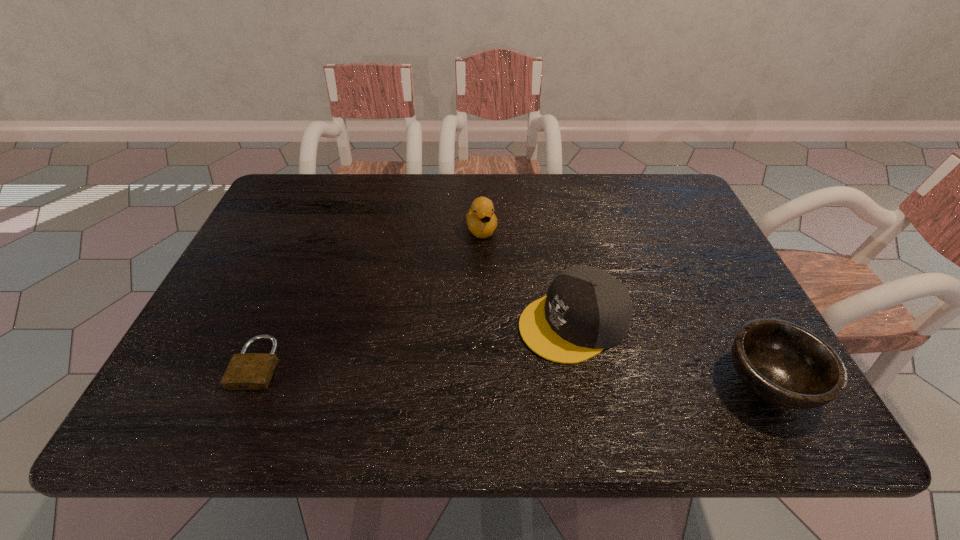
The image size is (960, 540). Identify the location of object at the near left corner. (246, 371).

Find the location of a particular element. The width and height of the screenshot is (960, 540). object positioned at the near right corner is located at coordinates (785, 364).

In the image, there is a desktop. Identify the location of vacant space at the far edge. (530, 205).

In the image, there is a desktop. What are the coordinates of `free space at the near edge` in the screenshot? It's located at (564, 378).

In the image, there is a desktop. Where is `vacant space at the left edge`? The height and width of the screenshot is (540, 960). vacant space at the left edge is located at coordinates (276, 272).

In the image, there is a desktop. Where is `vacant region at the right edge`? vacant region at the right edge is located at coordinates (719, 314).

This screenshot has height=540, width=960. What are the coordinates of `free space at the far left corner of the desktop` in the screenshot? It's located at (x=281, y=195).

You are a GUI agent. You are given a task and a screenshot of the screen. Output one action in this format:
    pyautogui.click(x=<x>, y=<y>)
    Task: Click on the free region at the near left corner of the desktop
    Image resolution: width=960 pixels, height=540 pixels.
    Given the screenshot: What is the action you would take?
    pyautogui.click(x=166, y=383)

This screenshot has height=540, width=960. In the image, there is a desktop. In order to click on vacant space at the far right corner in this screenshot , I will do `click(682, 200)`.

In order to click on vacant region between the farthest object and the second object from right to left in this screenshot , I will do `click(528, 276)`.